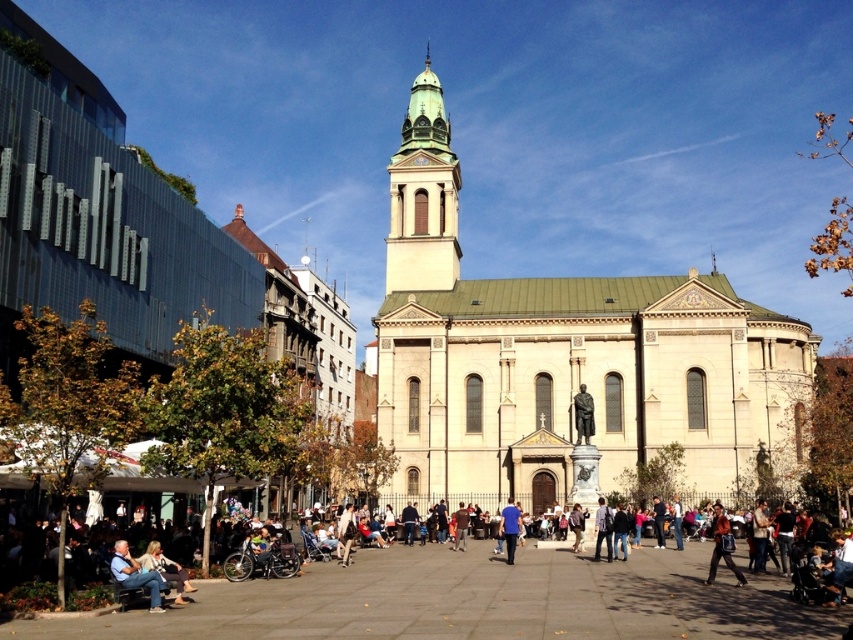
You are a photographer planning to take a wide shot of the beige stone church at center and the leather jacket at lower right. Given that your camera can only capture objects within a 5 meter width, will both objects fit in the frame?

The beige stone church at center is wider than the leather jacket at lower right. Since the camera can only capture objects within a 5 meter width, it depends on the actual width of the church. However, the description only states the church is wider than the jacket, but not the exact dimensions. Without knowing the exact width of the church, we cannot confirm if both will fit.

Looking at this image, you are standing at the entrance of the square and want to take a photo of the beige stone church at center. Based on its position, which direction should you face to ensure the church is centered in your camera view?

The beige stone church at center is located at point coordinates, so you should face directly towards the center of the square to capture it in your photo.

You are planning to take a photo of the green stone tower at center and the light brown leather bench at lower left from a spot where both are visible. Based on their sizes, which object should you focus on first to ensure both are in frame?

The green stone tower at center is larger than the light brown leather bench at lower left, so you should focus on positioning the larger tower first to ensure both fit within the frame.